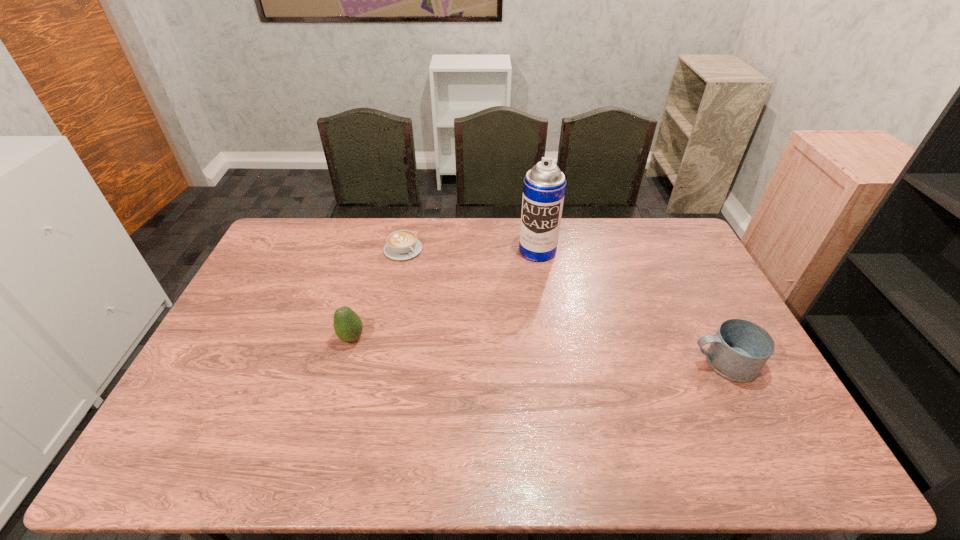
Locate an element on the screen. free space at the left edge of the desktop is located at coordinates (260, 357).

Image resolution: width=960 pixels, height=540 pixels. What are the coordinates of `vacant space at the right edge` in the screenshot? It's located at (675, 308).

The height and width of the screenshot is (540, 960). Identify the location of vacant space at the far left corner of the desktop. (292, 225).

Locate an element on the screen. This screenshot has height=540, width=960. free space at the near left corner of the desktop is located at coordinates point(237,403).

In the image, there is a desktop. Where is `vacant space at the far right corner`? vacant space at the far right corner is located at coordinates (661, 221).

Locate an element on the screen. vacant area that lies between the mug and the cappuccino is located at coordinates (564, 306).

Image resolution: width=960 pixels, height=540 pixels. Identify the location of free space between the tallest object and the avocado. (444, 294).

Where is `free space between the rightmost object and the shortest object`? free space between the rightmost object and the shortest object is located at coordinates (564, 306).

Locate an element on the screen. This screenshot has width=960, height=540. unoccupied area between the tallest object and the avocado is located at coordinates click(444, 294).

The width and height of the screenshot is (960, 540). Find the location of `vacant area that lies between the avocado and the tallest object`. vacant area that lies between the avocado and the tallest object is located at coordinates (444, 294).